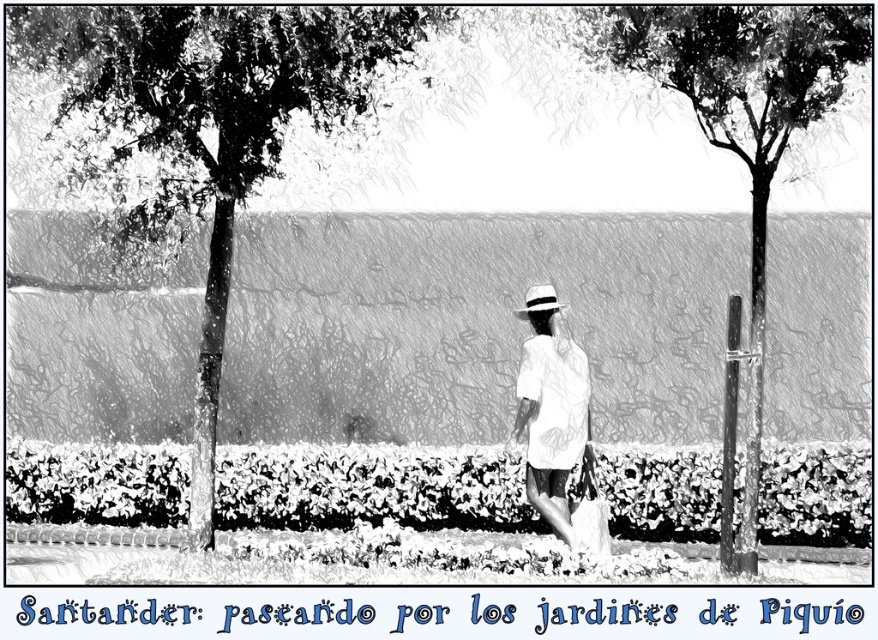
Question: Is the position of smooth bark tree at center more distant than that of white woven straw hat at center?

Choices:
 (A) yes
 (B) no

Answer: (B)

Question: Which object is farther from the camera taking this photo?

Choices:
 (A) green leafy tree at center
 (B) white matte dress at center
 (C) white woven straw hat at center

Answer: (C)

Question: Which object is positioned farthest from the soft green hedge at center?

Choices:
 (A) white woven straw hat at center
 (B) green leafy tree at center
 (C) white matte dress at center
 (D) smooth bark tree at center

Answer: (B)

Question: Does soft green hedge at center appear on the left side of smooth bark tree at center?

Choices:
 (A) no
 (B) yes

Answer: (B)

Question: In this image, where is green leafy tree at center located relative to soft green hedge at center?

Choices:
 (A) below
 (B) above

Answer: (B)

Question: Among these objects, which one is nearest to the camera?

Choices:
 (A) green leafy tree at center
 (B) white matte dress at center

Answer: (A)